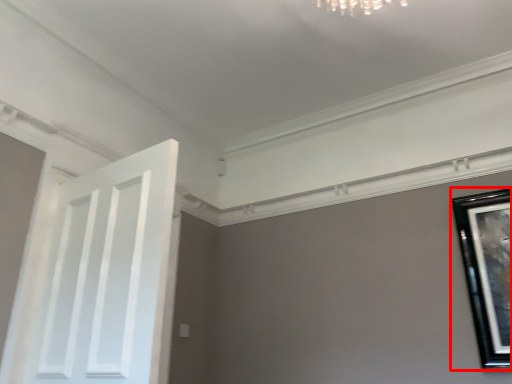
Question: From the image's perspective, what is the correct spatial relationship of picture frame (annotated by the red box) in relation to door?

Choices:
 (A) above
 (B) below

Answer: (B)